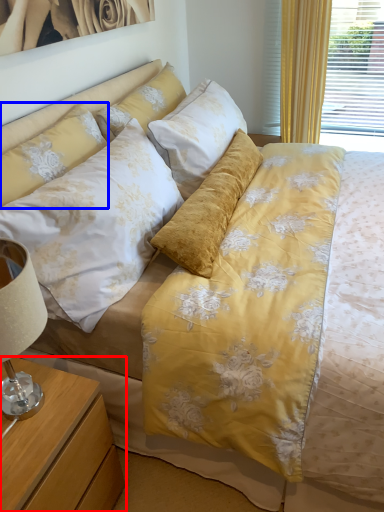
Question: Which of the following is the farthest to the observer, nightstand (highlighted by a red box) or pillow (highlighted by a blue box)?

Choices:
 (A) nightstand
 (B) pillow

Answer: (B)